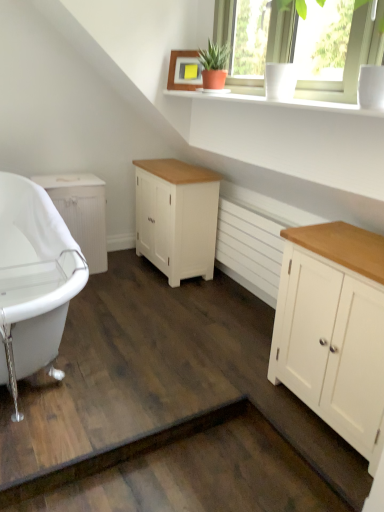
Question: In terms of width, does wooden picture frame at upper center look wider or thinner when compared to white painted wood cabinet at right, which appears as the 1th cabinetry when viewed from the right?

Choices:
 (A) wide
 (B) thin

Answer: (B)

Question: Would you say wooden picture frame at upper center is inside or outside white painted wood cabinet at right, which is counted as the first cabinetry, starting from the front?

Choices:
 (A) outside
 (B) inside

Answer: (A)

Question: Which object is the farthest from the wooden picture frame at upper center?

Choices:
 (A) white matte radiator at center
 (B) white painted wood cabinet at center, the 2th cabinetry in the front-to-back sequence
 (C) white glossy bathtub at lower left
 (D) white painted wood cabinet at right, the 3th cabinetry viewed from the left
 (E) white wood cabinet at left, placed as the third cabinetry when sorted from front to back

Answer: (D)

Question: Which object is the farthest from the white glossy bathtub at lower left?

Choices:
 (A) wooden picture frame at upper center
 (B) white painted wood cabinet at center, marked as the 2th cabinetry in a right-to-left arrangement
 (C) white matte radiator at center
 (D) white glossy cup at upper right
 (E) white smooth window sill at upper center

Answer: (D)